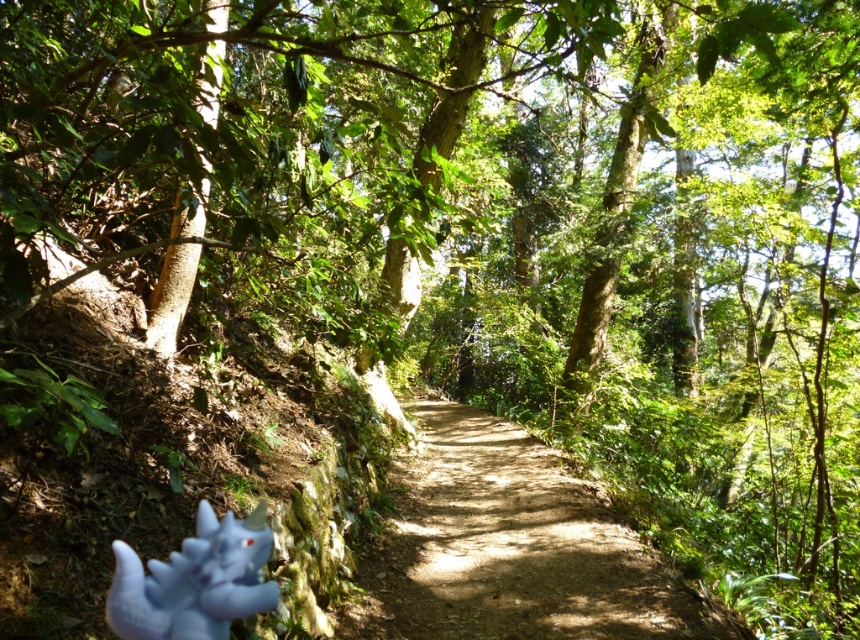
You are a hiker walking along the dirt path at center and see the blue plush toy at lower left. Which object is closer to the ground?

The dirt path at center is closer to the ground because it is below the blue plush toy at lower left.

You are a hiker who has just found the blue plush toy at lower left on the forest path. You want to place it on the dirt path at center so it won

The dirt path at center is 10.06 feet away from the blue plush toy at lower left. Since you are a hiker, you can easily pick up the blue plush toy at lower left and walk 10.06 feet to place it on the dirt path at center.

You are a photographer standing at the edge of the forest path. You want to capture a photo that includes both the blue dragon plush toy and the mossy slope. Which of the two points, point (x=617, y=556) or point (x=172, y=572), should you focus on to ensure both objects are in sharp focus?

You should focus on point (x=172, y=572) because it is closer to the camera than point (x=617, y=556). By focusing on the closer point, the depth of field will likely include both objects in sharp focus.